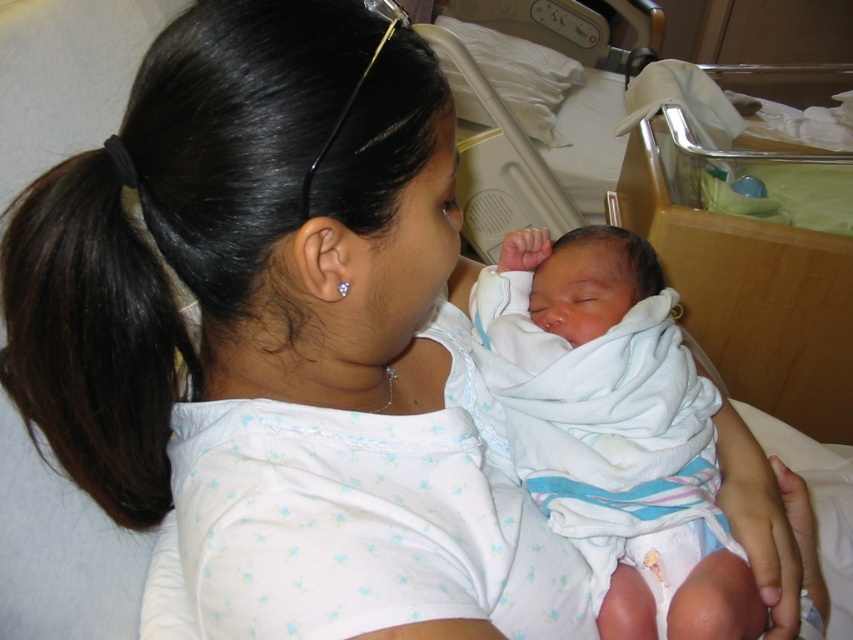
Question: Can you confirm if white soft swaddled newborn at center is wider than dark brown hair at upper left?

Choices:
 (A) no
 (B) yes

Answer: (B)

Question: Among these points, which one is nearest to the camera?

Choices:
 (A) (633, 374)
 (B) (129, 314)

Answer: (B)

Question: Which of the following is the farthest from the observer?

Choices:
 (A) (519, 406)
 (B) (155, 522)

Answer: (A)

Question: Can you confirm if white soft swaddled newborn at center is positioned to the right of dark brown hair at upper left?

Choices:
 (A) yes
 (B) no

Answer: (A)

Question: Can you confirm if white soft swaddled newborn at center is bigger than dark brown hair at upper left?

Choices:
 (A) no
 (B) yes

Answer: (B)